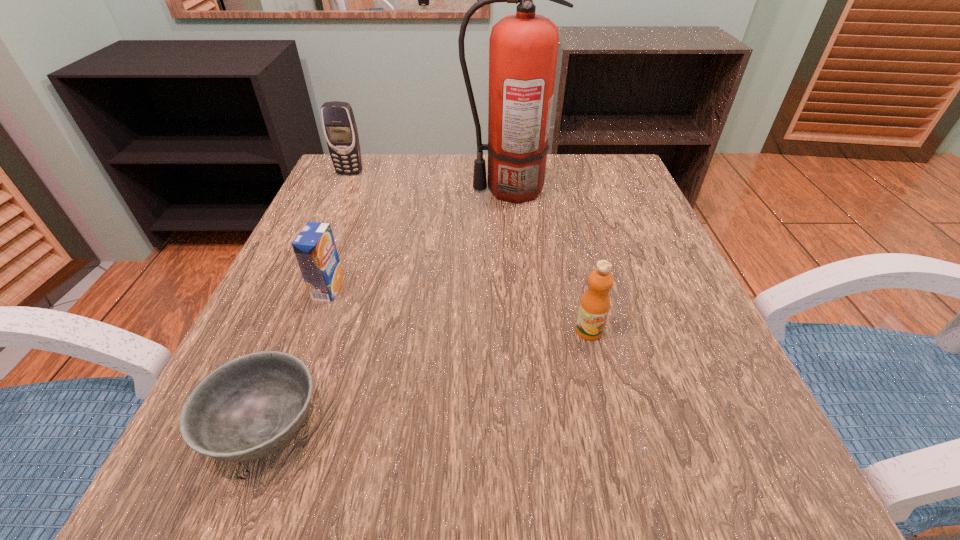
Where is `vacant space that satisfies the following two spatial constraints: 1. on the nozzle of the tallest object; 2. on the front side of the third farthest object`? Image resolution: width=960 pixels, height=540 pixels. vacant space that satisfies the following two spatial constraints: 1. on the nozzle of the tallest object; 2. on the front side of the third farthest object is located at coordinates (518, 289).

The width and height of the screenshot is (960, 540). Identify the location of free point that satisfies the following two spatial constraints: 1. on the front face of the shortest object; 2. on the left side of the second tallest object. (237, 428).

Find the location of a particular element. free space that satisfies the following two spatial constraints: 1. on the front face of the fourth shortest object; 2. on the right side of the left orange_juice is located at coordinates (299, 289).